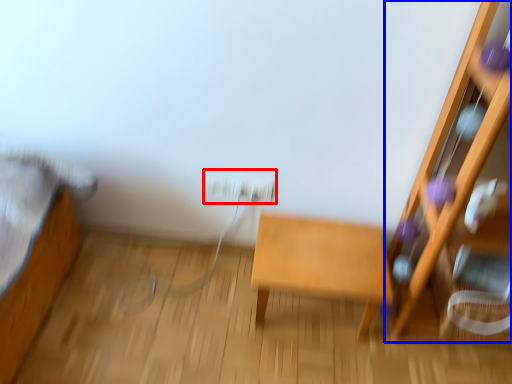
Question: Which object appears farthest to the camera in this image, electric outlet (highlighted by a red box) or furniture (highlighted by a blue box)?

Choices:
 (A) electric outlet
 (B) furniture

Answer: (A)